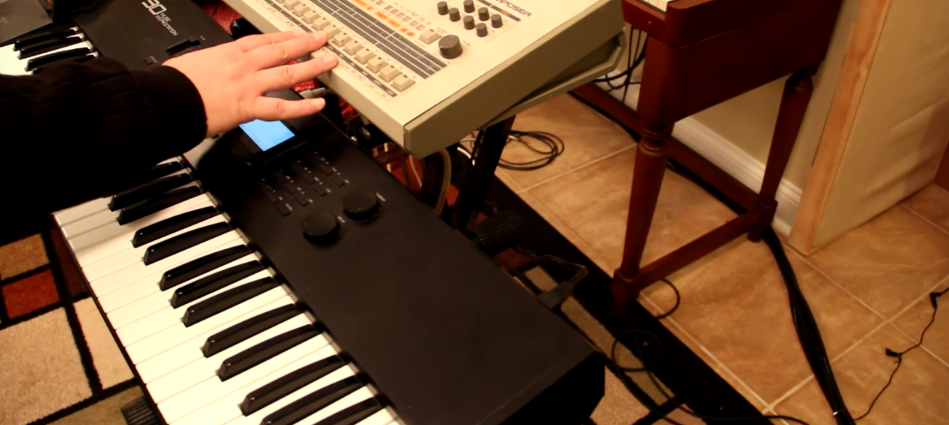
Where is `tiled floor`? Image resolution: width=949 pixels, height=425 pixels. tiled floor is located at coordinates (753, 326).